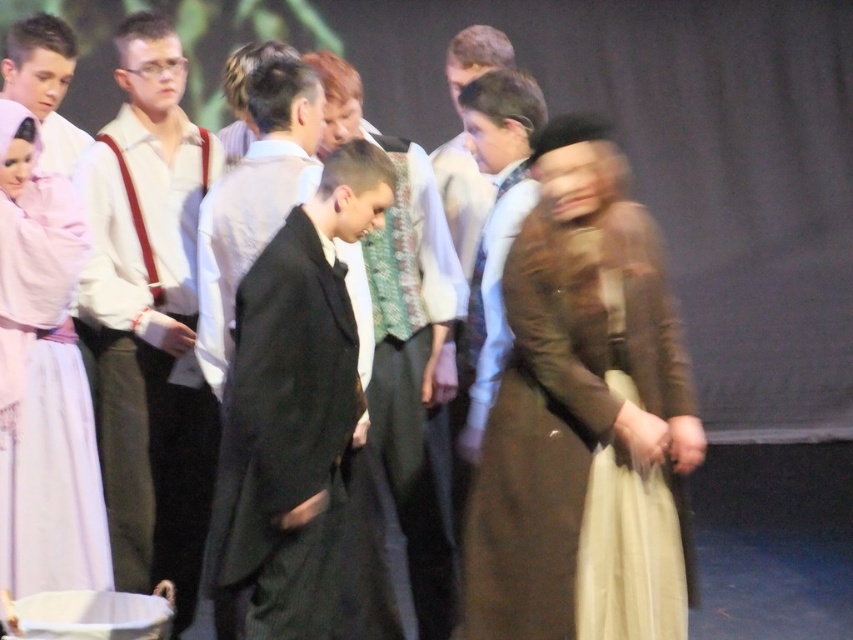
Question: Which of the following is the closest to the observer?

Choices:
 (A) (105, 150)
 (B) (419, 316)
 (C) (279, 310)
 (D) (666, 288)

Answer: (C)

Question: Which of the following is the farthest from the observer?

Choices:
 (A) black wool suit at center
 (B) matte white shirt at left
 (C) black woolen suit at center
 (D) brown textured coat at center

Answer: (A)

Question: In this image, where is brown textured coat at center located relative to black woolen suit at center?

Choices:
 (A) below
 (B) above

Answer: (B)

Question: Estimate the real-world distances between objects in this image. Which object is closer to the brown textured coat at center?

Choices:
 (A) pale pink satin dress at left
 (B) black woolen suit at center

Answer: (B)

Question: Observing the image, what is the correct spatial positioning of brown textured coat at center in reference to pale pink satin dress at left?

Choices:
 (A) right
 (B) left

Answer: (A)

Question: Is brown textured coat at center to the left of matte white shirt at left from the viewer's perspective?

Choices:
 (A) yes
 (B) no

Answer: (B)